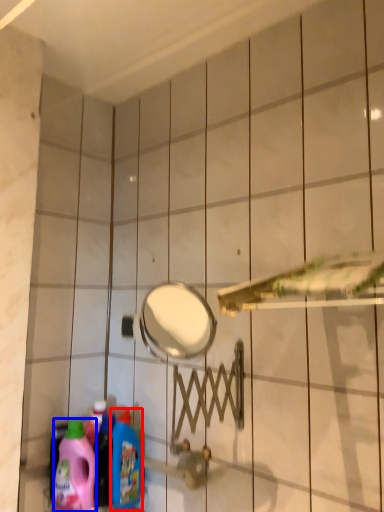
Question: Among these objects, which one is farthest to the camera, cleaning product (highlighted by a red box) or cleaning product (highlighted by a blue box)?

Choices:
 (A) cleaning product
 (B) cleaning product

Answer: (A)